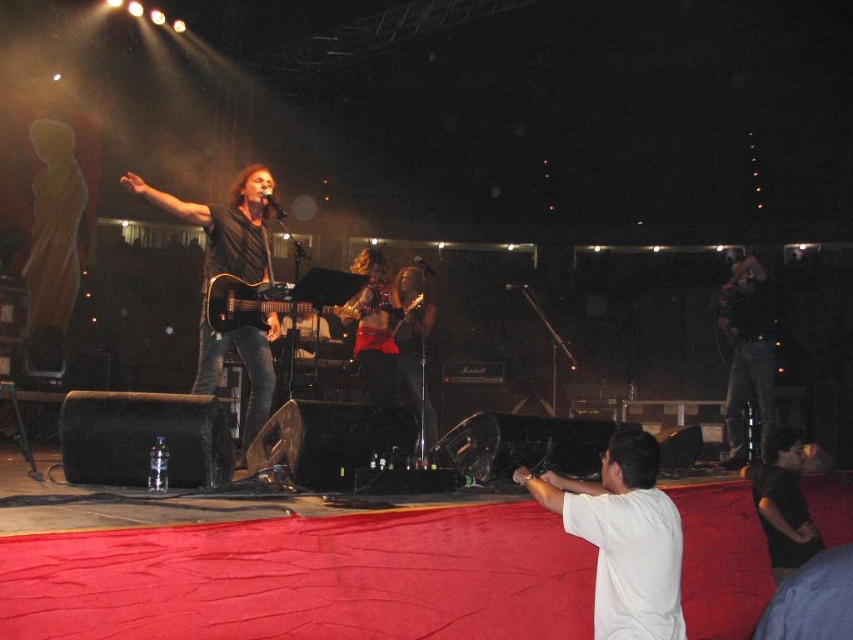
Question: Does black matte guitar at center appear under black matte shirt at lower right?

Choices:
 (A) no
 (B) yes

Answer: (A)

Question: Among these points, which one is farthest from the camera?

Choices:
 (A) (236, 204)
 (B) (677, 588)

Answer: (A)

Question: Which of these objects is positioned farthest from the white cotton shirt at center?

Choices:
 (A) black matte shirt at lower right
 (B) black matte guitar at center

Answer: (B)

Question: Where is white cotton shirt at center located in relation to black matte guitar at center in the image?

Choices:
 (A) left
 (B) right

Answer: (B)

Question: Is white cotton shirt at center behind black matte shirt at lower right?

Choices:
 (A) no
 (B) yes

Answer: (A)

Question: Which of these objects is positioned closest to the white cotton shirt at center?

Choices:
 (A) black matte shirt at lower right
 (B) black matte guitar at center

Answer: (A)